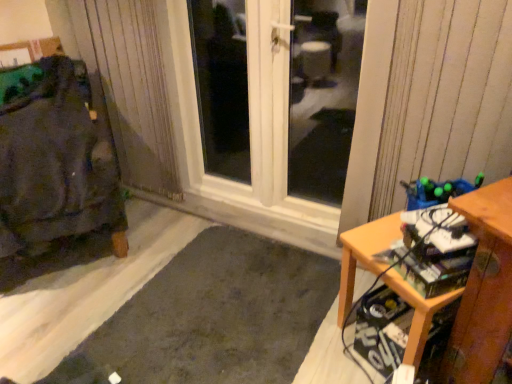
Question: Is point (308, 180) positioned closer to the camera than point (322, 274)?

Choices:
 (A) closer
 (B) farther

Answer: (B)

Question: In terms of height, does transparent glass door at center look taller or shorter compared to dark gray carpet at lower left?

Choices:
 (A) short
 (B) tall

Answer: (B)

Question: Which of these objects is positioned farthest from the dark gray fabric at left?

Choices:
 (A) dark gray carpet at lower left
 (B) white plastic window at center
 (C) wooden desk at lower right
 (D) transparent glass door at center

Answer: (D)

Question: Estimate the real-world distances between objects in this image. Which object is farther from the white plastic window at center?

Choices:
 (A) wooden desk at lower right
 (B) dark gray fabric at left
 (C) dark gray carpet at lower left
 (D) transparent glass door at center

Answer: (A)